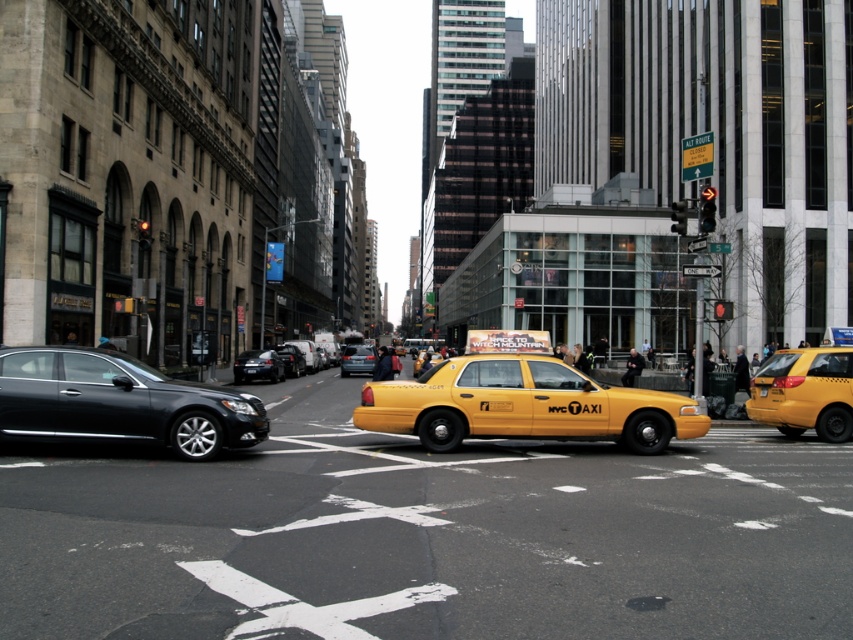
Question: Which object is positioned closest to the shiny black sedan at center-left?

Choices:
 (A) metallic gray sedan at center
 (B) yellow matte taxi at right
 (C) shiny black sedan at left
 (D) yellow matte taxi at center

Answer: (A)

Question: Does yellow matte taxi at center have a greater width compared to shiny black sedan at left?

Choices:
 (A) no
 (B) yes

Answer: (A)

Question: Can you confirm if yellow matte taxi at right is positioned above shiny black sedan at center-left?

Choices:
 (A) no
 (B) yes

Answer: (B)

Question: Estimate the real-world distances between objects in this image. Which object is closer to the yellow matte taxi at center?

Choices:
 (A) metallic gray sedan at center
 (B) shiny black sedan at center-left

Answer: (B)

Question: Is yellow matte taxi at center above shiny black sedan at center-left?

Choices:
 (A) yes
 (B) no

Answer: (A)

Question: Among these objects, which one is farthest from the camera?

Choices:
 (A) shiny black sedan at left
 (B) yellow matte taxi at right
 (C) shiny black sedan at center

Answer: (C)